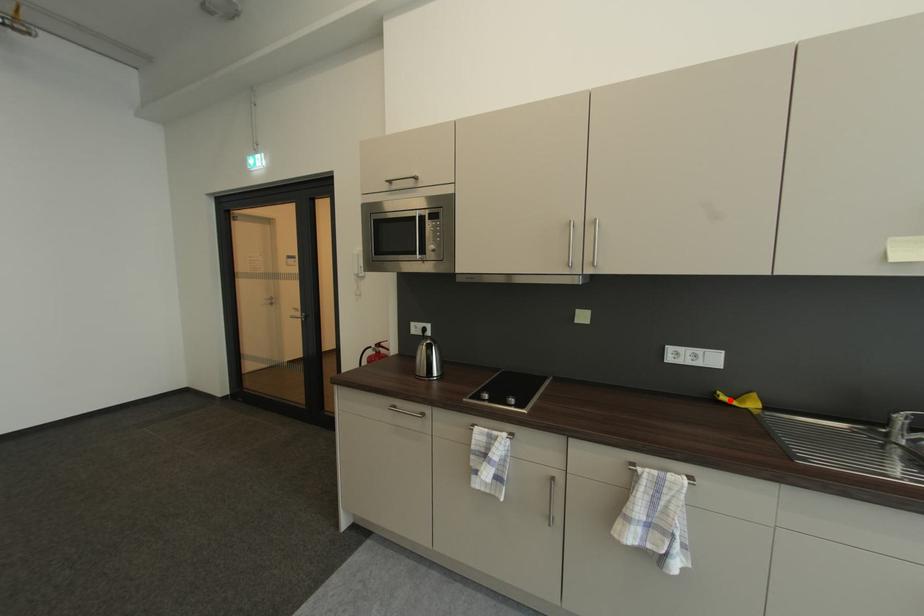
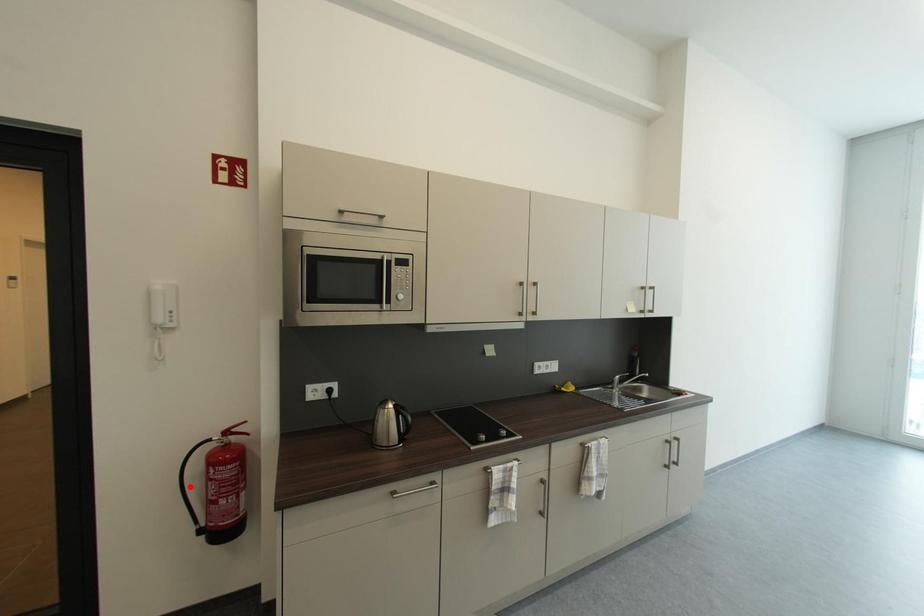
I am providing you with two images of the same scene from different viewpoints. A red point is marked on the first image and another point is marked on the second image. Does the point marked in image1 correspond to the same location as the one in image2?

No